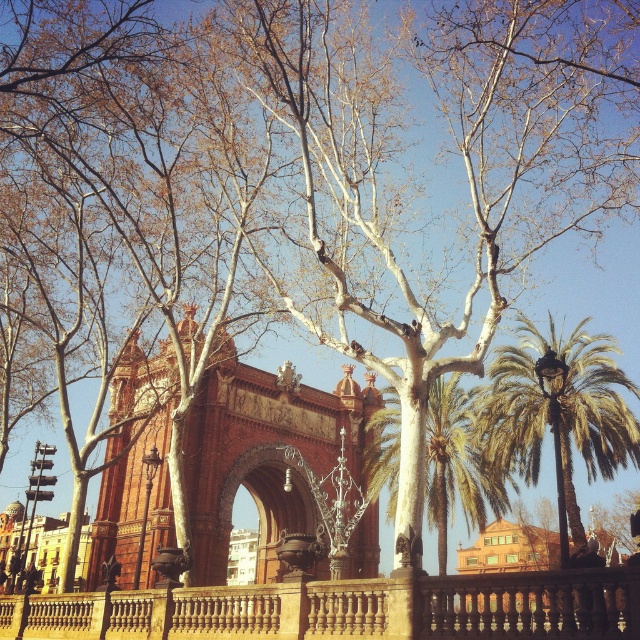
Question: Which point is closer to the camera?

Choices:
 (A) polished bronze archway at center
 (B) green leafy palm tree at right
 (C) green leafy palm tree at center

Answer: (B)

Question: Can you confirm if green leafy palm tree at right is positioned above green leafy palm tree at center?

Choices:
 (A) yes
 (B) no

Answer: (A)

Question: Can you confirm if green leafy palm tree at right is smaller than green leafy palm tree at center?

Choices:
 (A) yes
 (B) no

Answer: (B)

Question: Which of the following is the farthest from the observer?

Choices:
 (A) (436, 435)
 (B) (608, 339)
 (C) (301, 476)

Answer: (B)

Question: Is green leafy palm tree at right to the left of green leafy palm tree at center from the viewer's perspective?

Choices:
 (A) yes
 (B) no

Answer: (B)

Question: Which object is farther from the camera taking this photo?

Choices:
 (A) green leafy palm tree at center
 (B) polished bronze archway at center
 (C) green leafy palm tree at right

Answer: (B)